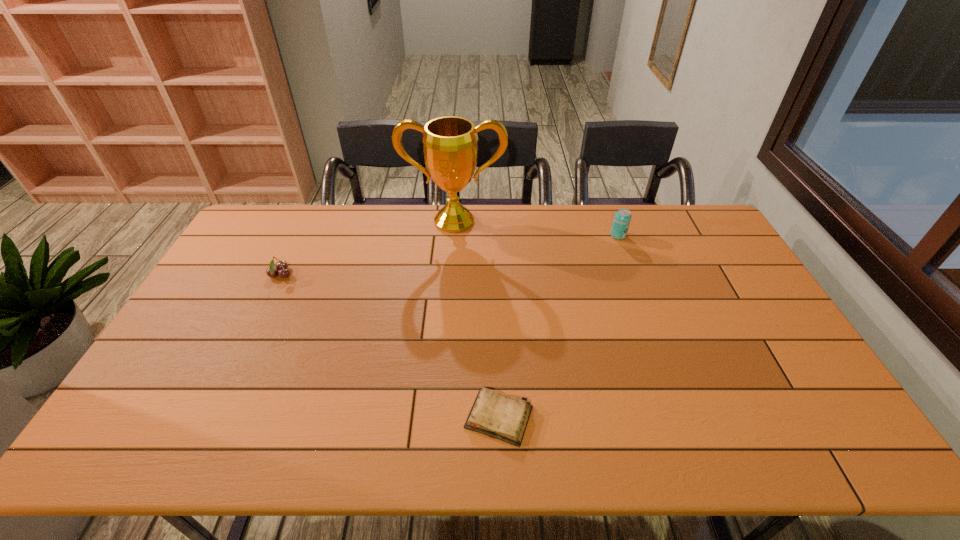
Find the location of a particular element. the tallest object is located at coordinates (450, 146).

Locate an element on the screen. Image resolution: width=960 pixels, height=540 pixels. beer can is located at coordinates (622, 218).

Image resolution: width=960 pixels, height=540 pixels. What are the coordinates of `the third shortest object` in the screenshot? It's located at click(622, 218).

Locate an element on the screen. The width and height of the screenshot is (960, 540). the leftmost object is located at coordinates (281, 266).

At what (x,y) coordinates should I click in order to perform the action: click on cherry. Please return your answer as a coordinate pair (x, y). Looking at the image, I should click on (281, 266).

You are a GUI agent. You are given a task and a screenshot of the screen. Output one action in this format:
    pyautogui.click(x=<x>, y=<y>)
    Task: Click on the diary
    The image size is (960, 540).
    Given the screenshot: What is the action you would take?
    pyautogui.click(x=498, y=416)

Locate an element on the screen. This screenshot has height=540, width=960. the shortest object is located at coordinates (498, 416).

Identify the location of vacant region located 0.210m on the front-facing side of the tallest object. (450, 275).

Find the location of a particular element. free space located 0.200m on the right of the beer can is located at coordinates (682, 235).

Where is `blank space located on the leaves of the leftmost object`? The image size is (960, 540). blank space located on the leaves of the leftmost object is located at coordinates coord(391,275).